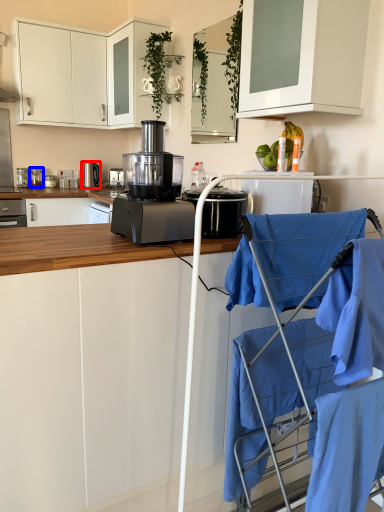
Question: Which object is further to the camera taking this photo, home appliance (highlighted by a red box) or kitchen appliance (highlighted by a blue box)?

Choices:
 (A) home appliance
 (B) kitchen appliance

Answer: (A)